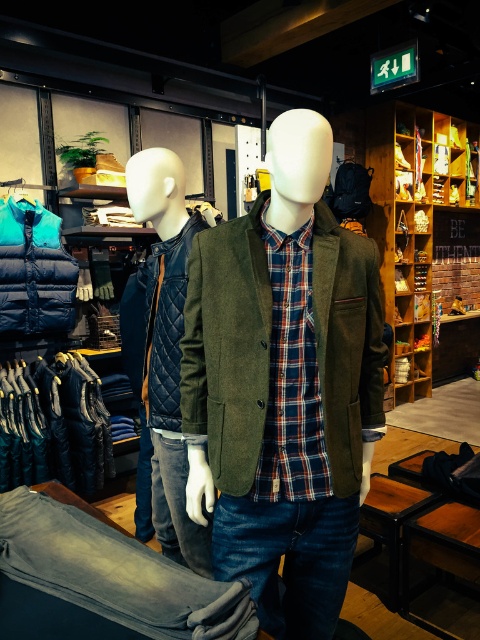
Question: Among these objects, which one is farthest from the camera?

Choices:
 (A) quilted leather jacket at left
 (B) blue down vest at left

Answer: (B)

Question: Which point is closer to the camera?

Choices:
 (A) (305, 205)
 (B) (47, 253)

Answer: (A)

Question: Does denim pants at center lie behind quilted leather jacket at left?

Choices:
 (A) yes
 (B) no

Answer: (B)

Question: Observing the image, what is the correct spatial positioning of matte green blazer at center in reference to plaid cotton shirt at center?

Choices:
 (A) below
 (B) above

Answer: (A)

Question: Is quilted leather jacket at left smaller than blue down vest at left?

Choices:
 (A) no
 (B) yes

Answer: (A)

Question: Which of the following is the closest to the observer?

Choices:
 (A) (144, 362)
 (B) (10, 614)
 (C) (319, 472)
 (D) (66, 282)

Answer: (B)